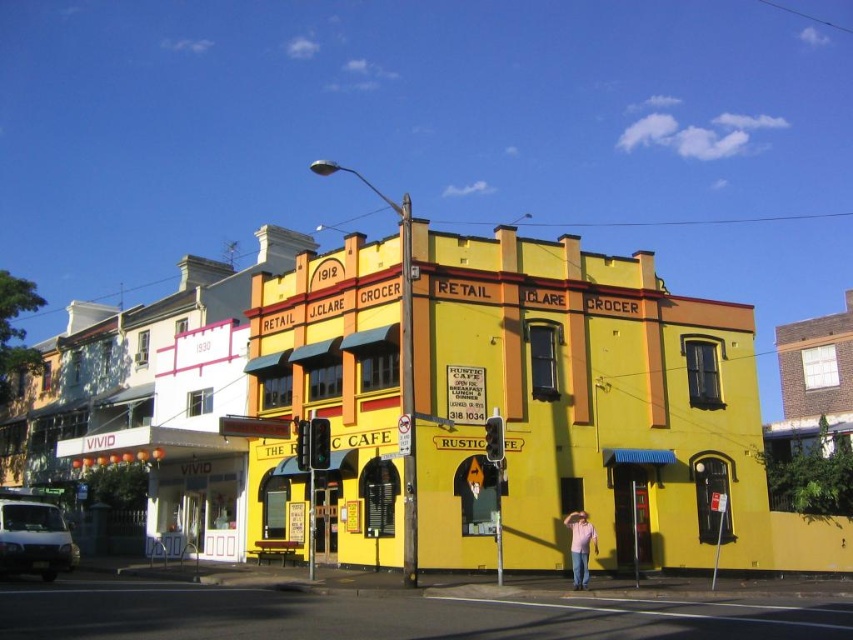
You are a photographer setting up a tripod in the street. You need to capture both the yellow matte building at center and the pink cotton shirt at lower right in your shot. Which object should you frame first to ensure both are fully visible?

Result: You should frame the yellow matte building at center first because its width is greater than the pink cotton shirt at lower right, so it requires more space in the composition to ensure both are fully visible.

You are standing at the origin point of the coordinate system. You want to walk to the yellow matte building at center. In which direction should you move?

The yellow matte building at center is located at coordinate point 0.631 on the x axis and 0.678 on the y axis. Since you are at the origin point, you should move in the positive x and positive y direction to reach it.

You are a photographer trying to capture both the yellow matte building at center and the pink cotton shirt at lower right in the same frame. Considering their sizes, which object should you focus on to ensure both are clearly visible in your photo?

The yellow matte building at center is larger in size than the pink cotton shirt at lower right. To ensure both are clearly visible, focus on the yellow matte building at center as it takes up more space in the frame, allowing the smaller pink cotton shirt at lower right to still be visible without overcrowding.